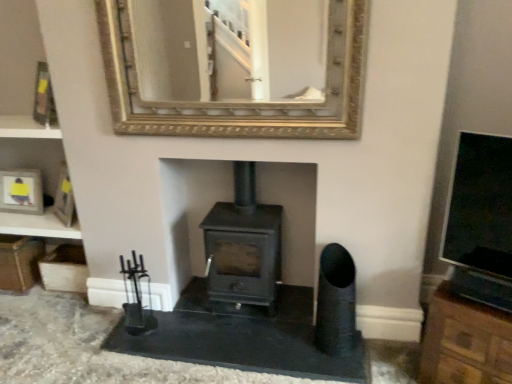
Question: From a real-world perspective, does black matte wood burning stove at center sit lower than metallic gold picture frame at upper left?

Choices:
 (A) no
 (B) yes

Answer: (B)

Question: Can you confirm if black matte wood burning stove at center is smaller than metallic gold picture frame at upper left?

Choices:
 (A) no
 (B) yes

Answer: (A)

Question: Does black matte wood burning stove at center have a greater width compared to metallic gold picture frame at upper left?

Choices:
 (A) yes
 (B) no

Answer: (A)

Question: From the image's perspective, is black matte wood burning stove at center over metallic gold picture frame at upper left?

Choices:
 (A) no
 (B) yes

Answer: (A)

Question: Considering the relative sizes of black matte wood burning stove at center and metallic gold picture frame at upper left in the image provided, is black matte wood burning stove at center shorter than metallic gold picture frame at upper left?

Choices:
 (A) yes
 (B) no

Answer: (B)

Question: Do you think metallic gold picture frame at upper left is within gold-framed mirror at upper center, or outside of it?

Choices:
 (A) outside
 (B) inside

Answer: (A)

Question: From the image's perspective, is metallic gold picture frame at upper left above or below gold-framed mirror at upper center?

Choices:
 (A) below
 (B) above

Answer: (A)

Question: In terms of width, does metallic gold picture frame at upper left look wider or thinner when compared to gold-framed mirror at upper center?

Choices:
 (A) wide
 (B) thin

Answer: (A)

Question: In terms of size, does metallic gold picture frame at upper left appear bigger or smaller than gold-framed mirror at upper center?

Choices:
 (A) big
 (B) small

Answer: (B)

Question: Do you think black matte wood burning stove at center is within brown wood cabinet at right, or outside of it?

Choices:
 (A) outside
 (B) inside

Answer: (A)

Question: In the image, is black matte wood burning stove at center on the left side or the right side of brown wood cabinet at right?

Choices:
 (A) left
 (B) right

Answer: (A)

Question: In the image, is black matte wood burning stove at center positioned in front of or behind brown wood cabinet at right?

Choices:
 (A) behind
 (B) front

Answer: (A)

Question: In terms of width, does black matte wood burning stove at center look wider or thinner when compared to brown wood cabinet at right?

Choices:
 (A) thin
 (B) wide

Answer: (A)

Question: Is point (41, 71) positioned closer to the camera than point (437, 357)?

Choices:
 (A) farther
 (B) closer

Answer: (A)

Question: Do you think metallic gold picture frame at upper left is within brown wood cabinet at right, or outside of it?

Choices:
 (A) outside
 (B) inside

Answer: (A)